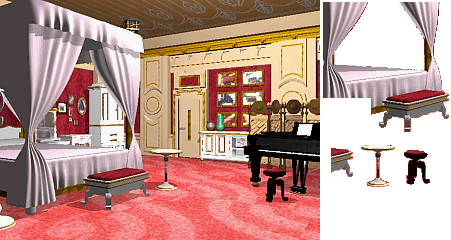
Find the location of a particular element. carpet is located at coordinates (203, 212).